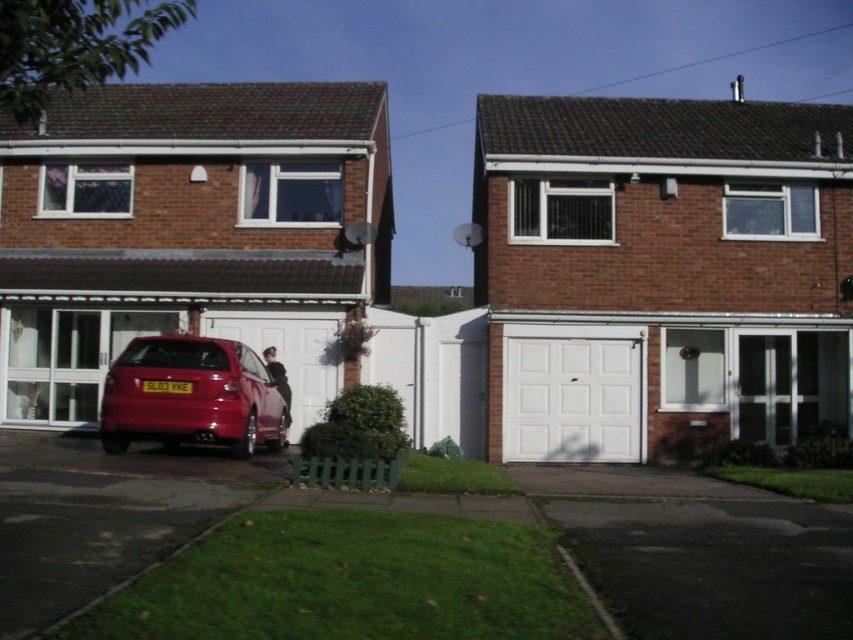
Is white matte garage door at center to the left of glossy red car at lower left from the viewer's perspective?

No, white matte garage door at center is not to the left of glossy red car at lower left.

Between white matte garage door at center and glossy red car at lower left, which one has more height?

white matte garage door at center

This screenshot has width=853, height=640. What do you see at coordinates (662, 273) in the screenshot?
I see `white matte garage door at center` at bounding box center [662, 273].

This screenshot has height=640, width=853. Identify the location of white matte garage door at center. (662, 273).